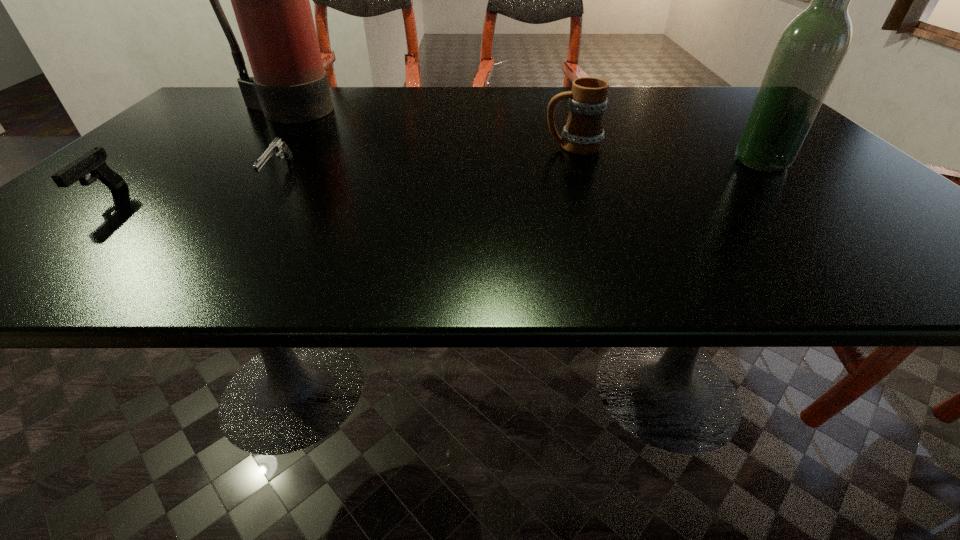
Find the location of a particular element. This screenshot has width=960, height=540. the farthest object is located at coordinates (270, 0).

Identify the location of liquor. (809, 52).

Locate an element on the screen. the third tallest object is located at coordinates (583, 134).

Where is `mug`? mug is located at coordinates (583, 134).

This screenshot has height=540, width=960. I want to click on the left pistol, so click(93, 162).

The height and width of the screenshot is (540, 960). What are the coordinates of `the leftmost object` in the screenshot? It's located at (93, 162).

Locate an element on the screen. The width and height of the screenshot is (960, 540). the shortest object is located at coordinates click(x=277, y=147).

Image resolution: width=960 pixels, height=540 pixels. I want to click on the shorter pistol, so click(277, 147).

The height and width of the screenshot is (540, 960). I want to click on free space located 0.200m at the nozzle of the farthest object, so click(240, 162).

Where is `vacant space located on the left of the liquor`? This screenshot has height=540, width=960. vacant space located on the left of the liquor is located at coordinates (710, 162).